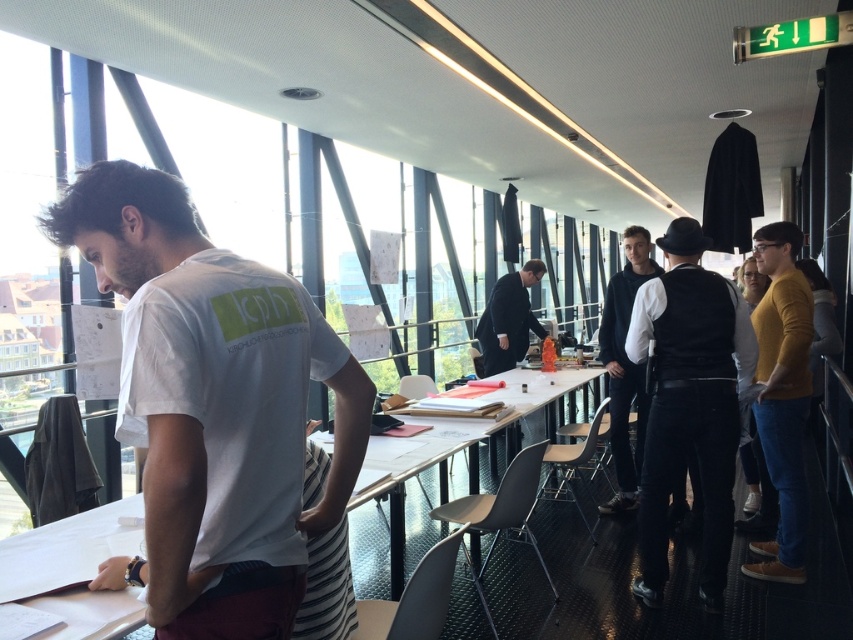
Does white cotton t-shirt at left have a lesser height compared to matte black suit at center?

Yes.

Identify the location of white cotton t-shirt at left. This screenshot has height=640, width=853. (213, 410).

Locate an element on the screen. Image resolution: width=853 pixels, height=640 pixels. white cotton t-shirt at left is located at coordinates (213, 410).

Which is above, white glossy table at center or black matte jacket at center?

Positioned higher is black matte jacket at center.

Is white glossy table at center positioned in front of black matte jacket at center?

No, it is not.

What do you see at coordinates (476, 436) in the screenshot?
I see `white glossy table at center` at bounding box center [476, 436].

At what (x,y) coordinates should I click in order to perform the action: click on white glossy table at center. Please return your answer as a coordinate pair (x, y). The height and width of the screenshot is (640, 853). Looking at the image, I should click on (476, 436).

Does point (148, 582) come behind point (80, 627)?

No.

Locate an element on the screen. The image size is (853, 640). white cotton t-shirt at left is located at coordinates (213, 410).